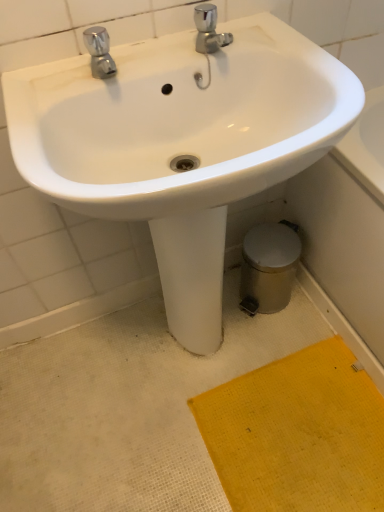
You are a GUI agent. You are given a task and a screenshot of the screen. Output one action in this format:
    pyautogui.click(x=<x>, y=<y>)
    Task: Click on the vacant space that is to the left of white glossy sink at center
    This screenshot has width=384, height=512.
    Given the screenshot: What is the action you would take?
    pyautogui.click(x=59, y=402)